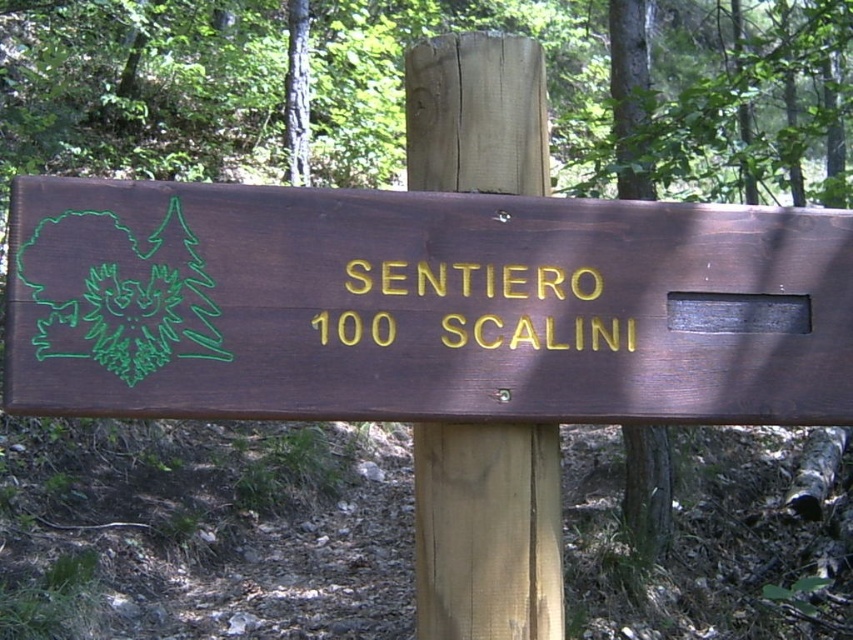
You are a hiker trying to read the trail signs in a forest. You see the brown wooden sign at center and the dark brown wood sign at center. Which one is larger?

The brown wooden sign at center is bigger than the dark brown wood sign at center.